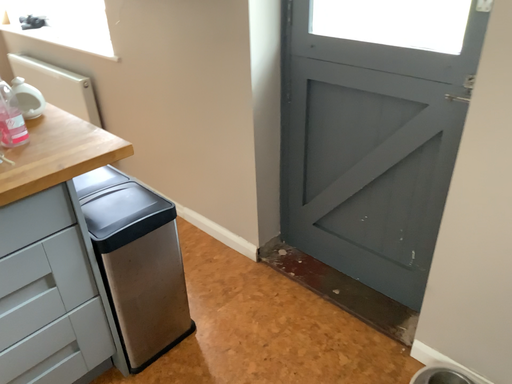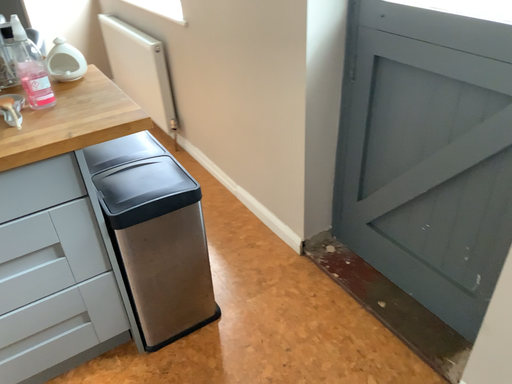
Question: Which way did the camera rotate in the video?

Choices:
 (A) rotated right
 (B) rotated left

Answer: (B)